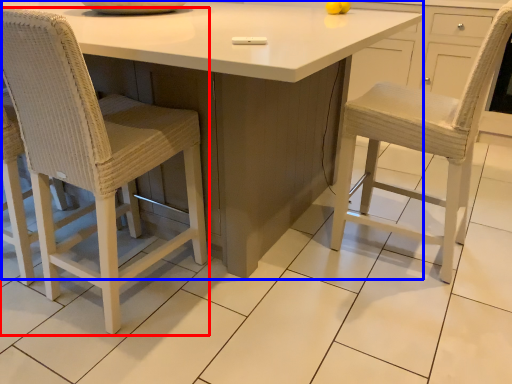
Question: Among these objects, which one is farthest to the camera, chair (highlighted by a red box) or table (highlighted by a blue box)?

Choices:
 (A) chair
 (B) table

Answer: (A)